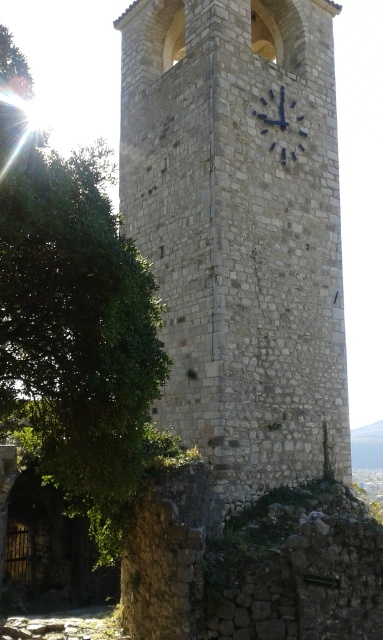
Question: Which point appears closest to the camera in this image?

Choices:
 (A) [x=126, y=394]
 (B) [x=237, y=477]

Answer: (A)

Question: From the image, what is the correct spatial relationship of white stone clock tower at center in relation to blue metallic clock at upper center?

Choices:
 (A) right
 (B) left

Answer: (B)

Question: Does white stone clock tower at center have a lesser width compared to blue metallic clock at upper center?

Choices:
 (A) no
 (B) yes

Answer: (A)

Question: Which object is the farthest from the white stone clock tower at center?

Choices:
 (A) green leafy tree at left
 (B) blue metallic clock at upper center

Answer: (A)

Question: Among these objects, which one is nearest to the camera?

Choices:
 (A) green leafy tree at left
 (B) blue metallic clock at upper center
 (C) white stone clock tower at center

Answer: (A)

Question: Is green leafy tree at left below blue metallic clock at upper center?

Choices:
 (A) yes
 (B) no

Answer: (A)